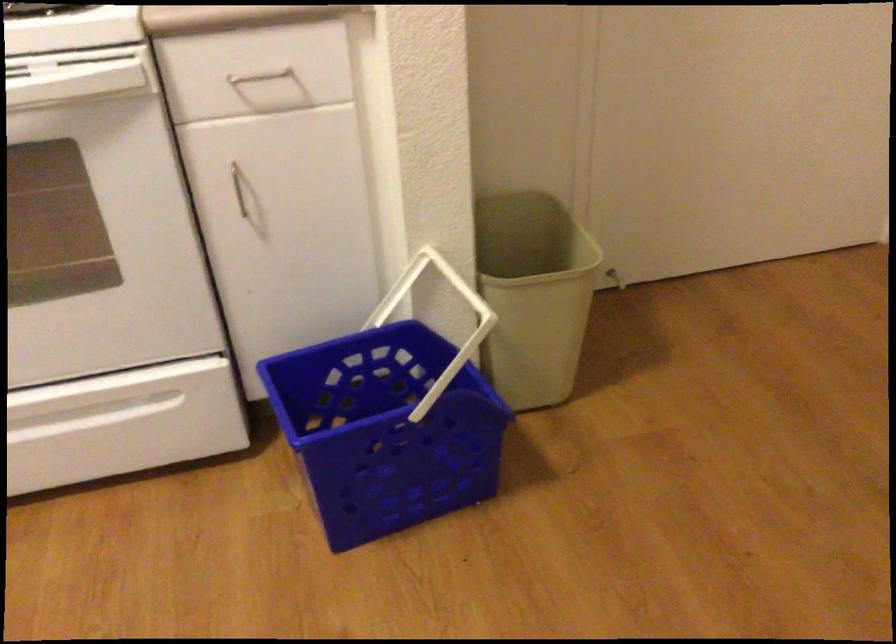
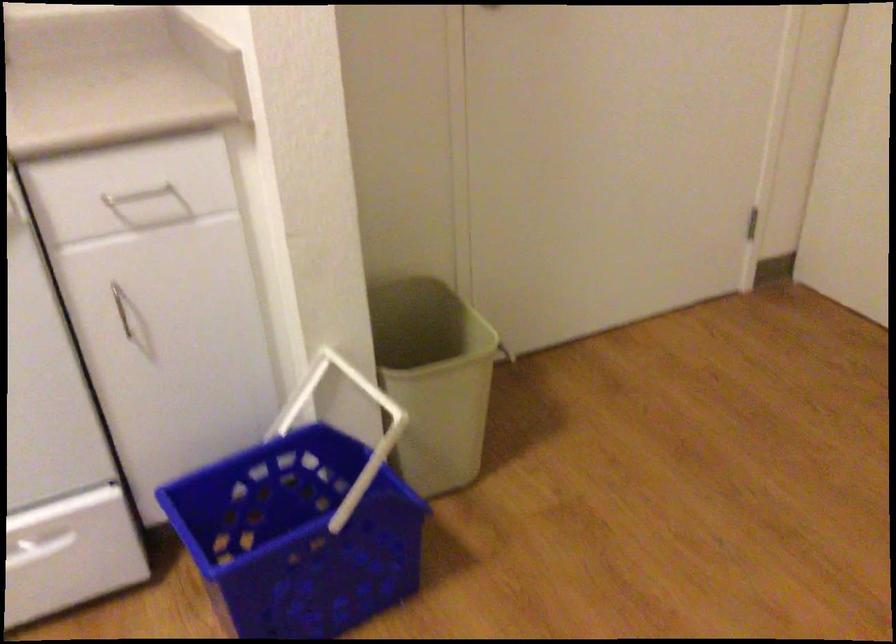
Find the pixel in the second image that matches pixel 238 187 in the first image.

(121, 307)